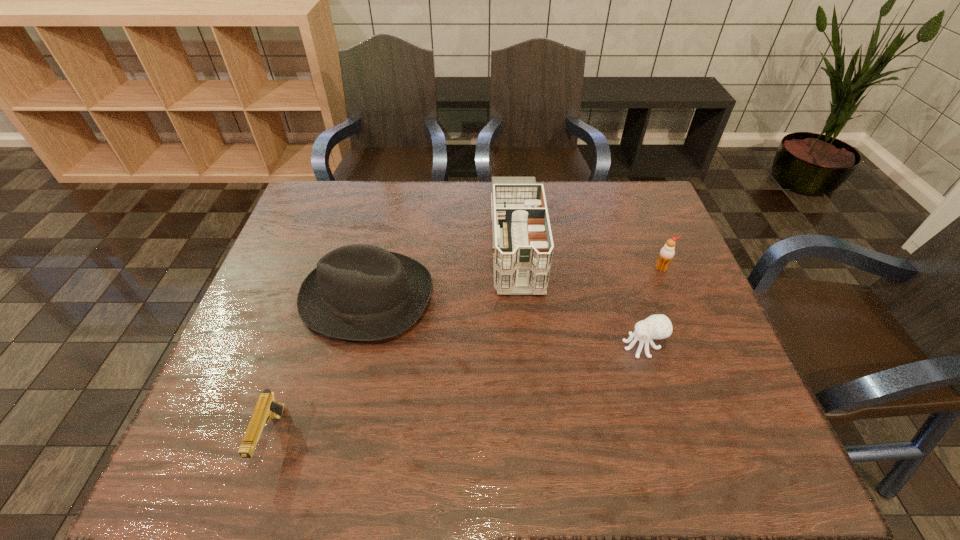
This screenshot has height=540, width=960. Identify the location of vacant space at the near edge. (401, 436).

Image resolution: width=960 pixels, height=540 pixels. What are the coordinates of `vacant area at the left edge` in the screenshot? It's located at (317, 250).

You are a GUI agent. You are given a task and a screenshot of the screen. Output one action in this format:
    pyautogui.click(x=<x>, y=<y>)
    Task: Click on the vacant space at the right edge
    The width and height of the screenshot is (960, 540).
    Given the screenshot: What is the action you would take?
    pyautogui.click(x=685, y=326)

Find the location of `vacant space at the far left corner`. vacant space at the far left corner is located at coordinates (329, 217).

Where is `blank space at the far right corner of the desktop`? The image size is (960, 540). blank space at the far right corner of the desktop is located at coordinates (636, 208).

Where is `free spot between the rightmost object and the second object from right to left`? free spot between the rightmost object and the second object from right to left is located at coordinates (652, 307).

You are a GUI agent. You are given a task and a screenshot of the screen. Output one action in this format:
    pyautogui.click(x=<x>, y=<y>)
    Task: Click on the free space between the octopus and the icecream
    Image resolution: width=960 pixels, height=540 pixels.
    Given the screenshot: What is the action you would take?
    pyautogui.click(x=652, y=307)

What are the coordinates of `unoccupied position between the third object from left to right and the fourth object from left to right` in the screenshot? It's located at (579, 294).

This screenshot has width=960, height=540. In order to click on vacant area that lies between the shortest object and the octopus in this screenshot , I will do `click(457, 392)`.

Image resolution: width=960 pixels, height=540 pixels. I want to click on empty space between the fourth object from left to right and the pistol, so click(457, 392).